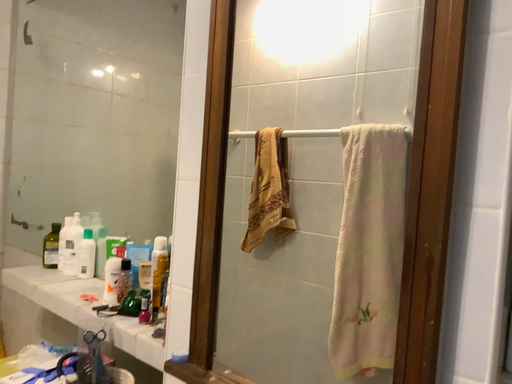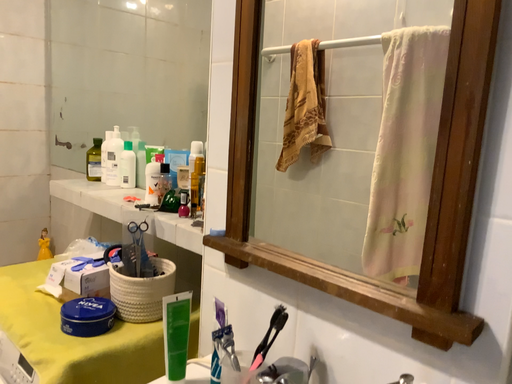
Question: How did the camera likely rotate when shooting the video?

Choices:
 (A) rotated upward
 (B) rotated downward

Answer: (B)